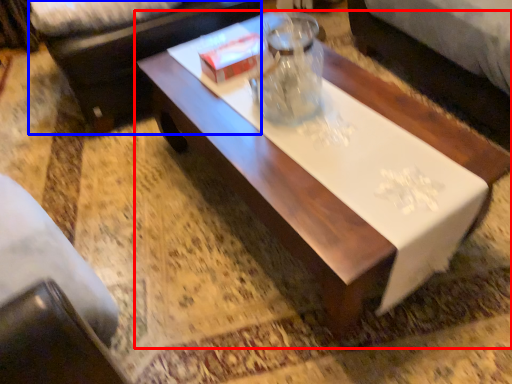
Question: Among these objects, which one is nearest to the camera, coffee table (highlighted by a red box) or couch (highlighted by a blue box)?

Choices:
 (A) coffee table
 (B) couch

Answer: (A)